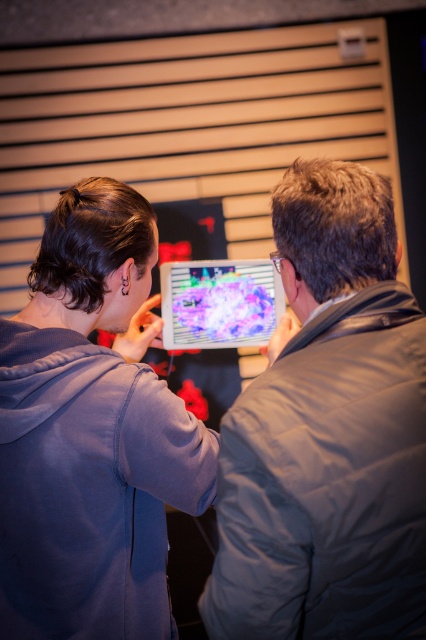
You are standing in a room with a tablet and two people. You need to locate the matte purple hoodie at center. Where exactly is it positioned in the room?

The matte purple hoodie at center is positioned at coordinates point (x=91, y=435) in the room.